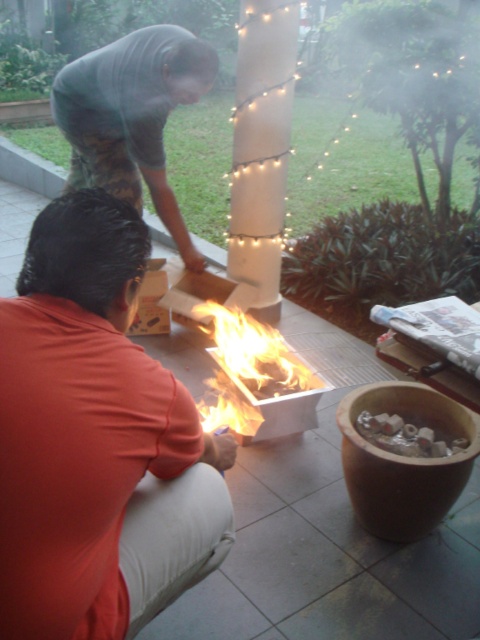
You are standing in the garden and want to hand a gift to both the orange cotton shirt at lower left and the dark gray shirt at upper left. Which one should you approach first based on their positions?

You should approach the orange cotton shirt at lower left first because it is positioned lower than the dark gray shirt at upper left, meaning it is closer to your current position in the garden.

You are standing at the center of the patio and notice the orange cotton shirt at lower left. If you want to move directly towards it, which direction should you walk?

The orange cotton shirt at lower left is located at point 0.689 on the x and 0.200 on the y coordinate, so you should walk towards the lower left direction to reach it.